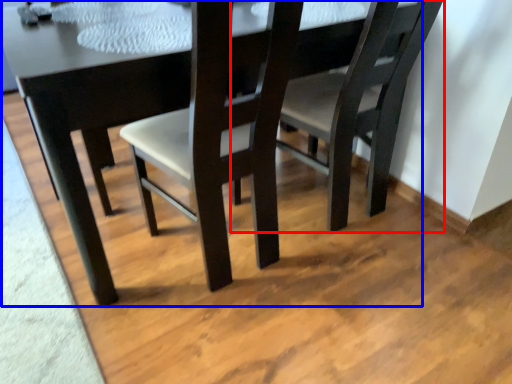
Question: Which point is further to the camera, chair (highlighted by a red box) or table (highlighted by a blue box)?

Choices:
 (A) chair
 (B) table

Answer: (A)